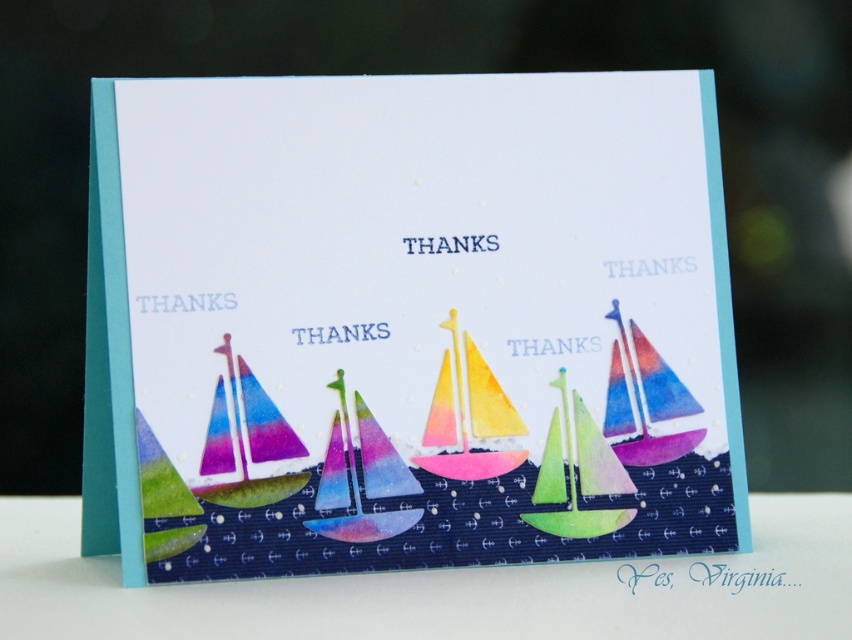
Does watercolor sailboats at lower center appear on the right side of watercolor sailboat at center?

In fact, watercolor sailboats at lower center is to the left of watercolor sailboat at center.

Is watercolor sailboats at lower center to the left of watercolor sailboat at center from the viewer's perspective?

Indeed, watercolor sailboats at lower center is positioned on the left side of watercolor sailboat at center.

I want to click on watercolor sailboats at lower center, so click(412, 324).

Who is more forward, (246, 621) or (432, 424)?

Point (246, 621) is more forward.

Can you confirm if white paper at lower center is positioned below watercolor sailboat at center?

Indeed, white paper at lower center is positioned under watercolor sailboat at center.

Measure the distance between point (594,596) and camera.

The distance of point (594,596) from camera is 1.14 meters.

Identify the location of white paper at lower center. Image resolution: width=852 pixels, height=640 pixels. (447, 588).

Does watercolor sailboats at lower center have a greater width compared to white paper at lower center?

Incorrect, watercolor sailboats at lower center's width does not surpass white paper at lower center's.

What do you see at coordinates (412, 324) in the screenshot? I see `watercolor sailboats at lower center` at bounding box center [412, 324].

Where is `watercolor sailboats at lower center`? The width and height of the screenshot is (852, 640). watercolor sailboats at lower center is located at coordinates (412, 324).

Where is `watercolor sailboats at lower center`? The width and height of the screenshot is (852, 640). watercolor sailboats at lower center is located at coordinates (412, 324).